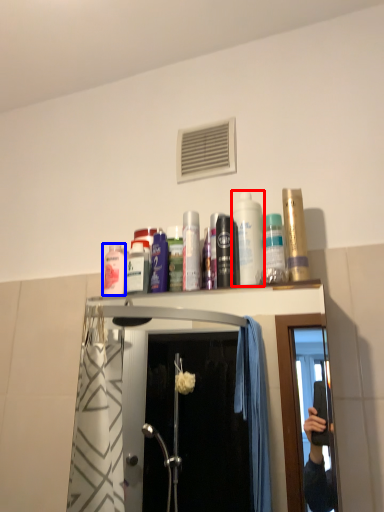
Question: Which of the following is the closest to the observer, mouthwash (highlighted by a red box) or mouthwash (highlighted by a blue box)?

Choices:
 (A) mouthwash
 (B) mouthwash

Answer: (A)